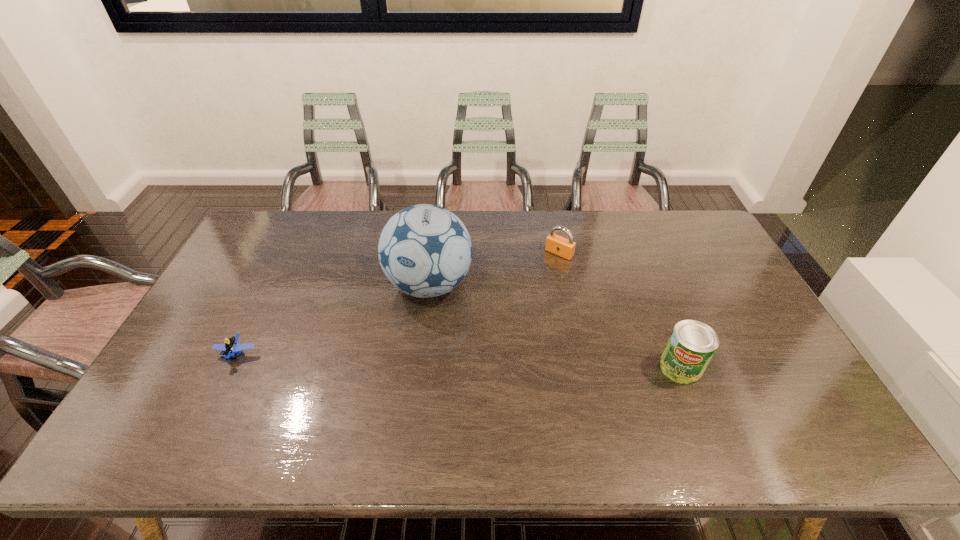
You are a GUI agent. You are given a task and a screenshot of the screen. Output one action in this format:
    pyautogui.click(x=<x>, y=<y>)
    Task: Click on the vacant space at the left edge
    
    Given the screenshot: What is the action you would take?
    pyautogui.click(x=228, y=291)

Identify the location of vacant space at the near left corner of the desktop. [x=170, y=400].

This screenshot has width=960, height=540. Identify the location of vacant space at the far right corner of the desktop. (670, 231).

You are a GUI agent. You are given a task and a screenshot of the screen. Output one action in this format:
    pyautogui.click(x=<x>, y=<y>)
    Task: Click on the free point between the third object from right to left and the second shortest object
    The height and width of the screenshot is (540, 960).
    Given the screenshot: What is the action you would take?
    pyautogui.click(x=494, y=269)

Where is `free space between the rightmost object and the second shortest object`? This screenshot has width=960, height=540. free space between the rightmost object and the second shortest object is located at coordinates (620, 310).

The width and height of the screenshot is (960, 540). In order to click on vacant area between the third object from right to left and the second object from right to left in this screenshot , I will do `click(494, 269)`.

Locate an element on the screen. The image size is (960, 540). free space between the second object from left to right and the third object from left to right is located at coordinates (494, 269).

Find the location of `free space that is in between the soccer ball and the shortest object`. free space that is in between the soccer ball and the shortest object is located at coordinates (333, 320).

This screenshot has height=540, width=960. Find the location of `vacant region between the Lego and the can`. vacant region between the Lego and the can is located at coordinates (459, 361).

The height and width of the screenshot is (540, 960). I want to click on free space between the third tallest object and the tallest object, so click(x=494, y=269).